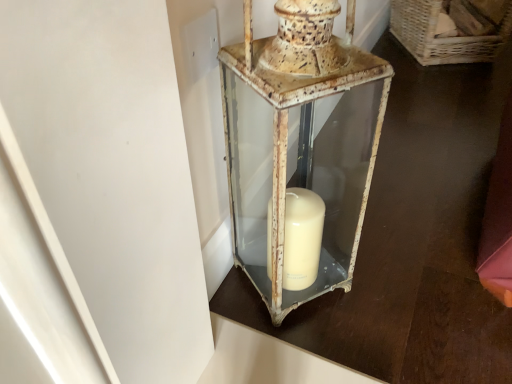
Find the location of a particular element. This screenshot has width=512, height=384. rusty metal lantern at center is located at coordinates pos(301,141).

What do you see at coordinates (301, 141) in the screenshot? This screenshot has height=384, width=512. I see `rusty metal lantern at center` at bounding box center [301, 141].

Measure the distance between woven wicker basket at upper right and camera.

The distance of woven wicker basket at upper right from camera is 1.61 meters.

Image resolution: width=512 pixels, height=384 pixels. I want to click on woven wicker basket at upper right, so click(x=442, y=38).

In order to face woven wicker basket at upper right, should I rotate leftwards or rightwards?

Turn right by 24.494 degrees to look at woven wicker basket at upper right.

What do you see at coordinates (442, 38) in the screenshot?
I see `woven wicker basket at upper right` at bounding box center [442, 38].

Identify the location of rusty metal lantern at center. The image size is (512, 384). (301, 141).

Is woven wicker basket at upper right at the right side of rusty metal lantern at center?

Yes.

Considering the positions of objects woven wicker basket at upper right and rusty metal lantern at center in the image provided, who is behind, woven wicker basket at upper right or rusty metal lantern at center?

woven wicker basket at upper right is further from the camera.

Considering the positions of point (424, 53) and point (228, 154), is point (424, 53) closer or farther from the camera than point (228, 154)?

Point (424, 53) is positioned farther from the camera compared to point (228, 154).

From the image's perspective, which object appears higher, woven wicker basket at upper right or rusty metal lantern at center?

A: woven wicker basket at upper right is shown above in the image.

From a real-world perspective, is woven wicker basket at upper right located beneath rusty metal lantern at center?

Yes.

Consider the image. Considering the sizes of objects woven wicker basket at upper right and rusty metal lantern at center in the image provided, who is thinner, woven wicker basket at upper right or rusty metal lantern at center?

rusty metal lantern at center is thinner.

Is woven wicker basket at upper right taller or shorter than rusty metal lantern at center?

In the image, woven wicker basket at upper right appears to be shorter than rusty metal lantern at center.

Considering the relative sizes of woven wicker basket at upper right and rusty metal lantern at center in the image provided, is woven wicker basket at upper right smaller than rusty metal lantern at center?

No.

Is woven wicker basket at upper right not within rusty metal lantern at center?

Yes, woven wicker basket at upper right is not within rusty metal lantern at center.

Is woven wicker basket at upper right touching rusty metal lantern at center?

No, woven wicker basket at upper right is not in contact with rusty metal lantern at center.

Looking at this image, is woven wicker basket at upper right looking in the opposite direction of rusty metal lantern at center?

That's not correct — woven wicker basket at upper right is not looking away from rusty metal lantern at center.

Identify the location of basket that appears on the right of rusty metal lantern at center. This screenshot has width=512, height=384. (442, 38).

Consider the image. Is rusty metal lantern at center to the left or to the right of woven wicker basket at upper right in the image?

Based on their positions, rusty metal lantern at center is located to the left of woven wicker basket at upper right.

Relative to woven wicker basket at upper right, is rusty metal lantern at center in front or behind?

Clearly, rusty metal lantern at center is in front of woven wicker basket at upper right.

Is point (339, 149) closer to camera compared to point (414, 35)?

Yes, point (339, 149) is in front of point (414, 35).

From the image's perspective, would you say rusty metal lantern at center is positioned over woven wicker basket at upper right?

No, from the image's perspective, rusty metal lantern at center is not on top of woven wicker basket at upper right.

From a real-world perspective, who is located lower, rusty metal lantern at center or woven wicker basket at upper right?

From a 3D spatial view, woven wicker basket at upper right is below.

Considering the sizes of rusty metal lantern at center and woven wicker basket at upper right in the image, is rusty metal lantern at center wider or thinner than woven wicker basket at upper right?

In the image, rusty metal lantern at center appears to be more narrow than woven wicker basket at upper right.

Can you confirm if rusty metal lantern at center is taller than woven wicker basket at upper right?

Indeed, rusty metal lantern at center has a greater height compared to woven wicker basket at upper right.

In terms of size, does rusty metal lantern at center appear bigger or smaller than woven wicker basket at upper right?

Considering their sizes, rusty metal lantern at center takes up less space than woven wicker basket at upper right.

Is rusty metal lantern at center located outside woven wicker basket at upper right?

Yes, rusty metal lantern at center is outside of woven wicker basket at upper right.

Are rusty metal lantern at center and woven wicker basket at upper right beside each other?

No, rusty metal lantern at center is not next to woven wicker basket at upper right.

In the scene shown: Could you tell me if rusty metal lantern at center is facing woven wicker basket at upper right?

No, rusty metal lantern at center is not facing towards woven wicker basket at upper right.

What's the angular difference between rusty metal lantern at center and woven wicker basket at upper right's facing directions?

The facing directions of rusty metal lantern at center and woven wicker basket at upper right are 20.1 degrees apart.

How distant is rusty metal lantern at center from woven wicker basket at upper right?

1.13 meters.

The width and height of the screenshot is (512, 384). What are the coordinates of `basket behind the rusty metal lantern at center` in the screenshot? It's located at (442, 38).

Locate an element on the screen. This screenshot has width=512, height=384. basket above the rusty metal lantern at center (from the image's perspective) is located at coordinates (442, 38).

You are a GUI agent. You are given a task and a screenshot of the screen. Output one action in this format:
    pyautogui.click(x=<x>, y=<y>)
    Task: Click on the lantern in front of the woven wicker basket at upper right
    
    Given the screenshot: What is the action you would take?
    pyautogui.click(x=301, y=141)